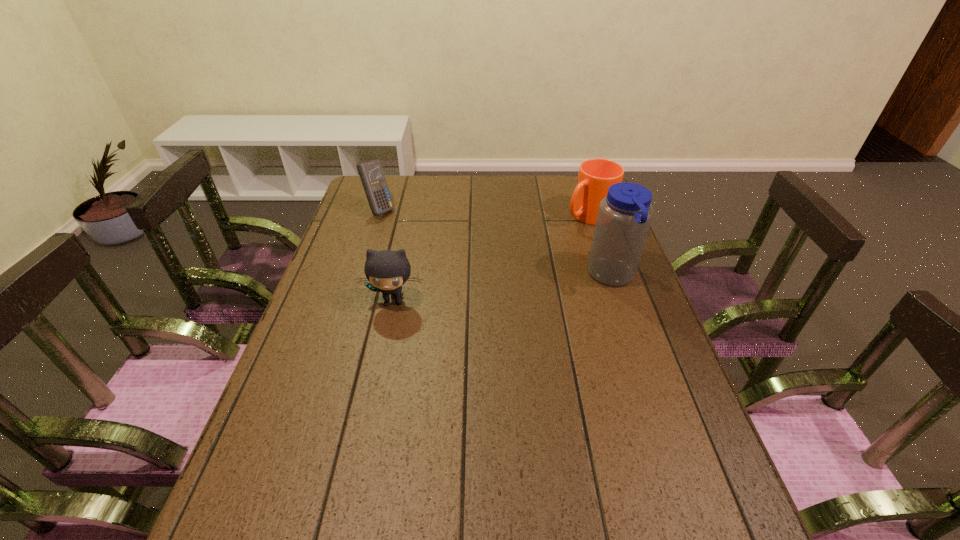
Find the location of a particular element. The width and height of the screenshot is (960, 540). free space located 0.110m on the front-facing side of the calculator is located at coordinates (411, 229).

At what (x,y) coordinates should I click in order to perform the action: click on free location located on the handle side of the mug. Please return your answer as a coordinate pair (x, y). Looking at the image, I should click on (512, 266).

I want to click on vacant space situated on the handle side of the mug, so click(x=507, y=269).

At what (x,y) coordinates should I click in order to perform the action: click on vacant space located 0.200m on the handle side of the mug. Please return your answer as a coordinate pair (x, y). The image size is (960, 540). Looking at the image, I should click on (535, 251).

Identify the location of calculator present at the far edge. (371, 174).

This screenshot has width=960, height=540. I want to click on mug located at the far edge, so click(595, 176).

The height and width of the screenshot is (540, 960). What are the coordinates of `kitten that is at the left edge` in the screenshot? It's located at pyautogui.click(x=387, y=271).

Where is `calculator situated at the left edge`? The width and height of the screenshot is (960, 540). calculator situated at the left edge is located at coordinates (371, 174).

I want to click on water bottle that is at the right edge, so click(x=624, y=216).

Identify the location of mug that is at the right edge. (595, 176).